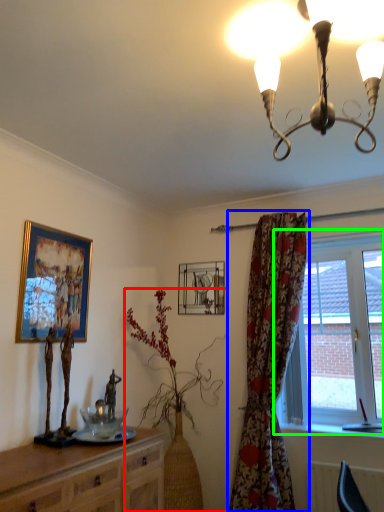
Question: Based on their relative distances, which object is nearer to houseplant (highlighted by a red box)? Choose from curtain (highlighted by a blue box) and window (highlighted by a green box).

Choices:
 (A) curtain
 (B) window

Answer: (A)